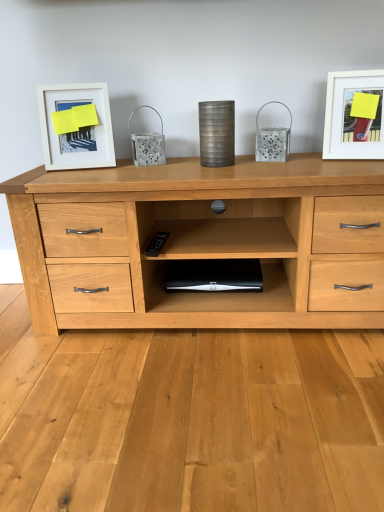
Question: Is white matte picture frame at upper left, acting as the 2th picture frame starting from the right, outside of white matte picture frame at upper right, which is the 1th picture frame in right-to-left order?

Choices:
 (A) no
 (B) yes

Answer: (B)

Question: Can you confirm if white matte picture frame at upper left, acting as the 2th picture frame starting from the right, is wider than white matte picture frame at upper right, the 2th picture frame positioned from the left?

Choices:
 (A) no
 (B) yes

Answer: (A)

Question: Is white matte picture frame at upper left, arranged as the first picture frame when viewed from the left, positioned with its back to white matte picture frame at upper right, the 2th picture frame positioned from the left?

Choices:
 (A) no
 (B) yes

Answer: (A)

Question: From the image's perspective, is white matte picture frame at upper left, arranged as the first picture frame when viewed from the left, on top of white matte picture frame at upper right, which is the 1th picture frame in right-to-left order?

Choices:
 (A) no
 (B) yes

Answer: (A)

Question: Is white matte picture frame at upper left, acting as the 2th picture frame starting from the right, closer to the viewer compared to white matte picture frame at upper right, the 2th picture frame positioned from the left?

Choices:
 (A) no
 (B) yes

Answer: (A)

Question: Considering the relative positions of white matte picture frame at upper right, which is the 1th picture frame in right-to-left order, and black plastic computer at center in the image provided, is white matte picture frame at upper right, which is the 1th picture frame in right-to-left order, to the left or to the right of black plastic computer at center?

Choices:
 (A) right
 (B) left

Answer: (A)

Question: In terms of height, does white matte picture frame at upper right, the 2th picture frame positioned from the left, look taller or shorter compared to black plastic computer at center?

Choices:
 (A) tall
 (B) short

Answer: (A)

Question: From a real-world perspective, is white matte picture frame at upper right, the 2th picture frame positioned from the left, above or below black plastic computer at center?

Choices:
 (A) above
 (B) below

Answer: (A)

Question: In the image, is white matte picture frame at upper right, which is the 1th picture frame in right-to-left order, positioned in front of or behind black plastic computer at center?

Choices:
 (A) front
 (B) behind

Answer: (A)

Question: Considering the positions of white matte picture frame at upper left, acting as the 2th picture frame starting from the right, and white matte picture frame at upper right, the 2th picture frame positioned from the left, in the image, is white matte picture frame at upper left, acting as the 2th picture frame starting from the right, bigger or smaller than white matte picture frame at upper right, the 2th picture frame positioned from the left,?

Choices:
 (A) small
 (B) big

Answer: (A)

Question: Does point (46, 123) appear closer or farther from the camera than point (347, 78)?

Choices:
 (A) closer
 (B) farther

Answer: (B)

Question: In terms of width, does white matte picture frame at upper left, acting as the 2th picture frame starting from the right, look wider or thinner when compared to white matte picture frame at upper right, which is the 1th picture frame in right-to-left order?

Choices:
 (A) wide
 (B) thin

Answer: (B)

Question: From the image's perspective, is white matte picture frame at upper left, arranged as the first picture frame when viewed from the left, located above or below white matte picture frame at upper right, the 2th picture frame positioned from the left?

Choices:
 (A) below
 (B) above

Answer: (A)

Question: In terms of size, does black plastic computer at center appear bigger or smaller than white matte picture frame at upper right, which is the 1th picture frame in right-to-left order?

Choices:
 (A) small
 (B) big

Answer: (A)

Question: From a real-world perspective, is black plastic computer at center positioned above or below white matte picture frame at upper right, the 2th picture frame positioned from the left?

Choices:
 (A) above
 (B) below

Answer: (B)